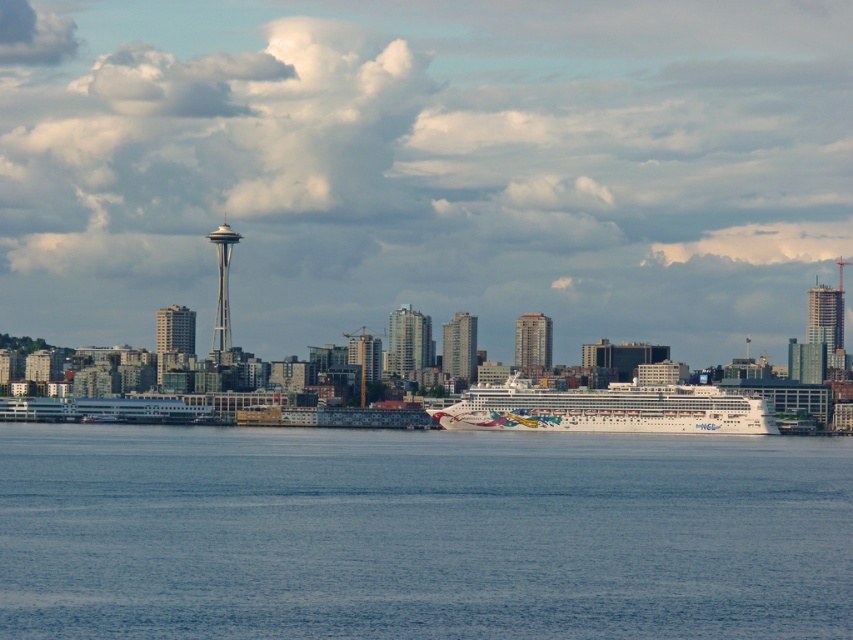
Looking at the Seattle skyline with the Space Needle in the background, you see the white glossy cruise ship at center and the glassy blue skyscraper at center. Which of these two objects is positioned more to the east if the cruise ship is to the right of the skyscraper?

The white glossy cruise ship at center is positioned more to the east because it is to the right of the glassy blue skyscraper at center, and in the image, right corresponds to east.

You are a photographer planning to capture the Seattle skyline with both the white glossy cruise ship at center and the smooth glass skyscraper at center in the same frame. Given their sizes, which object should you position closer to the camera to ensure both are visible and balanced in the photo?

Since the white glossy cruise ship at center is larger than the smooth glass skyscraper at center, you should position the smaller smooth glass skyscraper at center closer to the camera to balance their sizes in the photo.